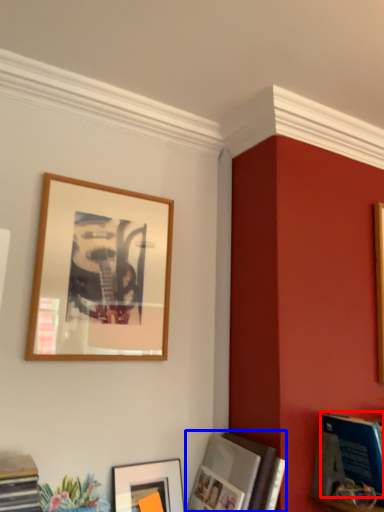
Question: Among these objects, which one is nearest to the camera, magazine (highlighted by a red box) or picture frame (highlighted by a blue box)?

Choices:
 (A) magazine
 (B) picture frame

Answer: (B)